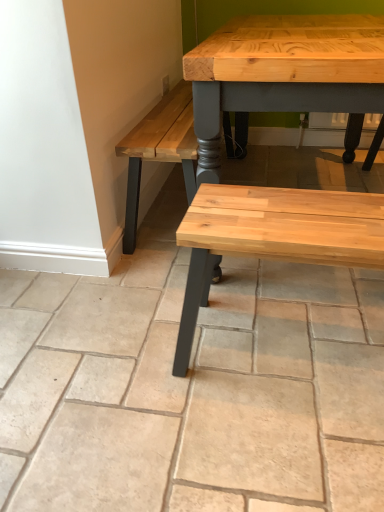
Locate an element on the screen. The width and height of the screenshot is (384, 512). free space in front of natural wood bench at center is located at coordinates (283, 445).